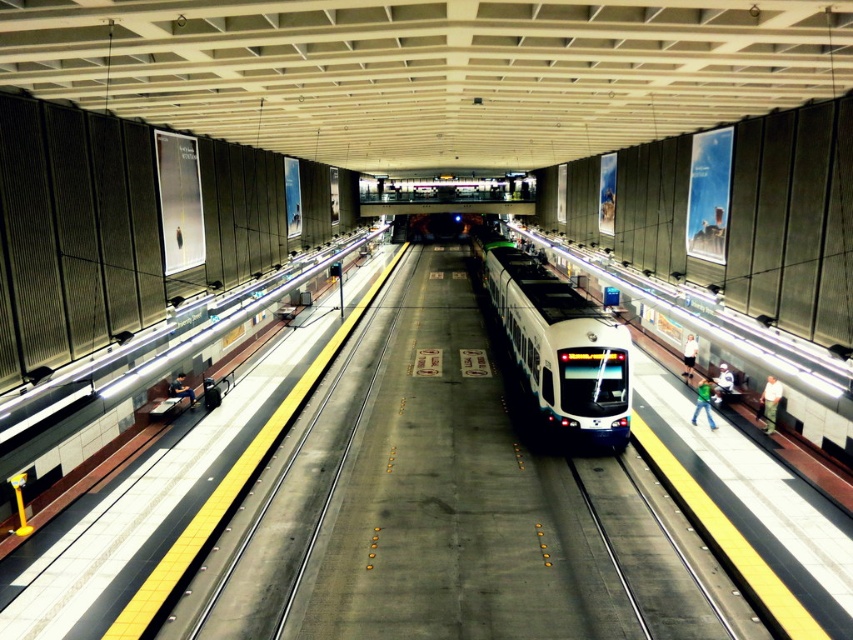
You are a commuter waiting on the platform and see both the green matte shirt at right and the green fabric shirt at right. Which one is positioned lower in the image?

The green matte shirt at right is located below the green fabric shirt at right, so it is positioned lower in the image.